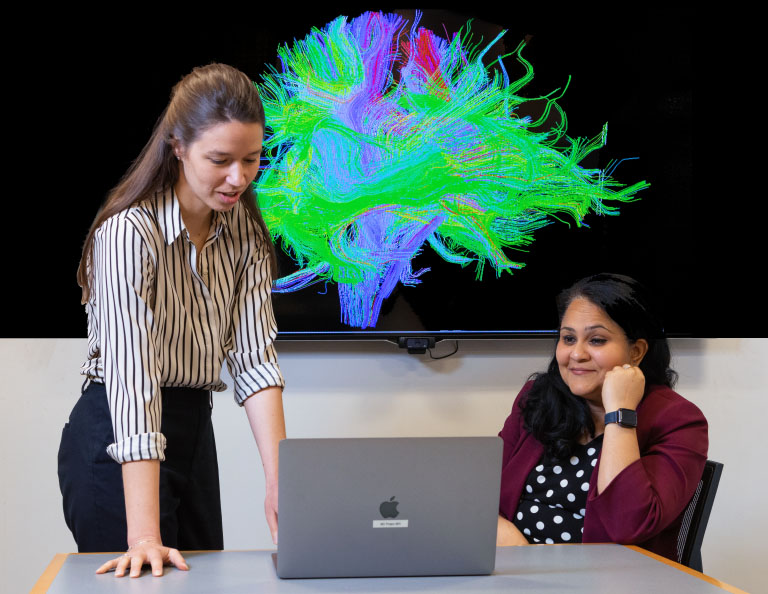
The image size is (768, 594). What are the coordinates of `shadows on the white wall` in the screenshot? It's located at (445, 387).